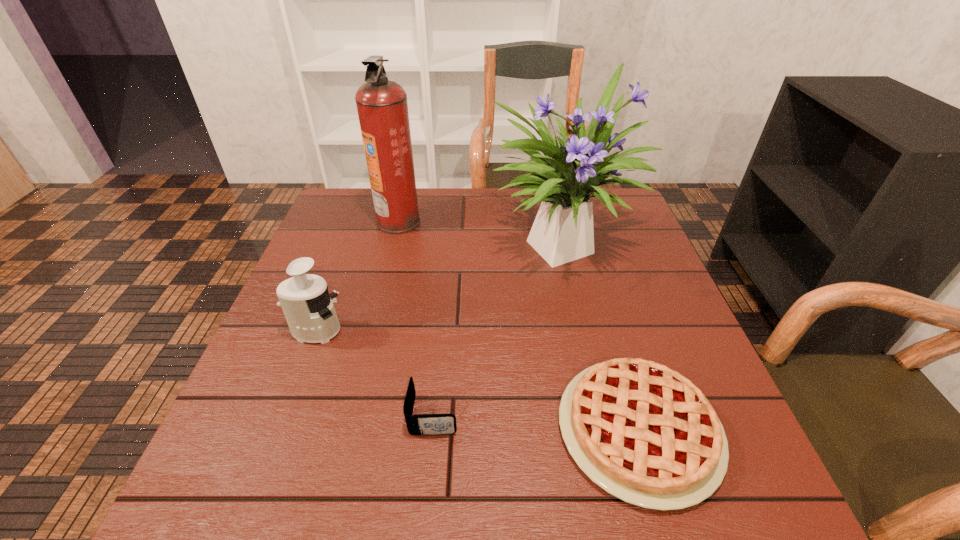
Find the location of a particular element. Image resolution: width=960 pixels, height=540 pixels. free point that satisfies the following two spatial constraints: 1. at the nozzle of the fire extinguisher; 2. on the right side of the flower arrangement is located at coordinates (394, 241).

This screenshot has height=540, width=960. Identify the location of free spot that satisfies the following two spatial constraints: 1. at the nozzle of the fire extinguisher; 2. on the left side of the flower arrangement. (394, 241).

This screenshot has width=960, height=540. Identify the location of free point that satisfies the following two spatial constraints: 1. on the outer surface of the third object from right to left; 2. on the left side of the pie. (432, 430).